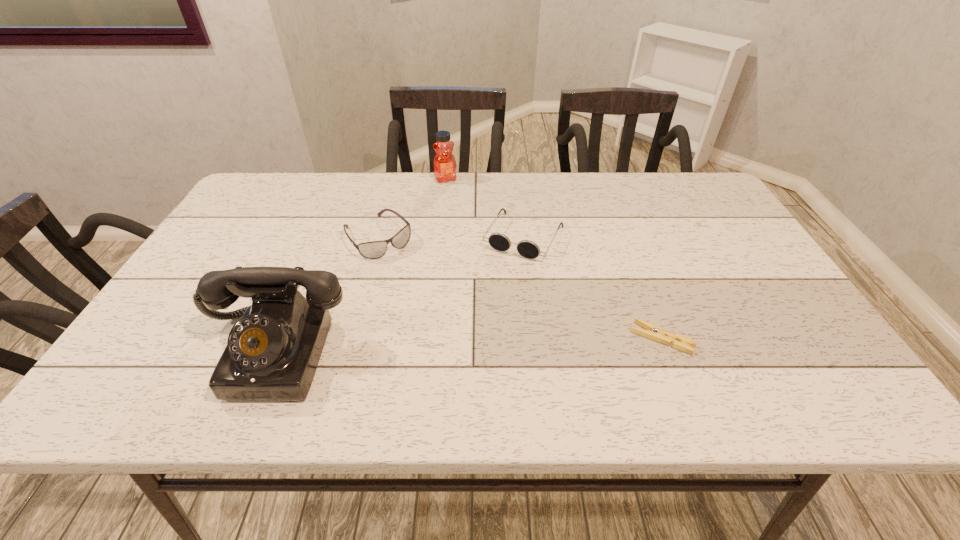
I want to click on telephone, so click(x=272, y=353).

The image size is (960, 540). I want to click on the shortest object, so click(656, 333).

Find the location of a particular element. the rightmost object is located at coordinates (656, 333).

Image resolution: width=960 pixels, height=540 pixels. In order to click on the left sunglasses in this screenshot , I will do `click(375, 249)`.

Image resolution: width=960 pixels, height=540 pixels. Find the location of `the third object from left to right`. the third object from left to right is located at coordinates (444, 161).

Image resolution: width=960 pixels, height=540 pixels. What are the coordinates of `the fourth shortest object` in the screenshot? It's located at (444, 161).

At what (x,y) coordinates should I click in order to perform the action: click on the fourth object from left to right. Please return your answer as a coordinate pair (x, y). This screenshot has width=960, height=540. Looking at the image, I should click on (498, 241).

At what (x,y) coordinates should I click in order to perform the action: click on vacant space located on the left of the shortest object. Please return your answer as a coordinate pair (x, y). The width and height of the screenshot is (960, 540). Looking at the image, I should click on (462, 339).

Locate an element on the screen. The width and height of the screenshot is (960, 540). vacant space located 0.370m on the lenses of the left sunglasses is located at coordinates (478, 345).

Locate an element on the screen. The image size is (960, 540). blank area located 0.120m on the lenses of the left sunglasses is located at coordinates (418, 281).